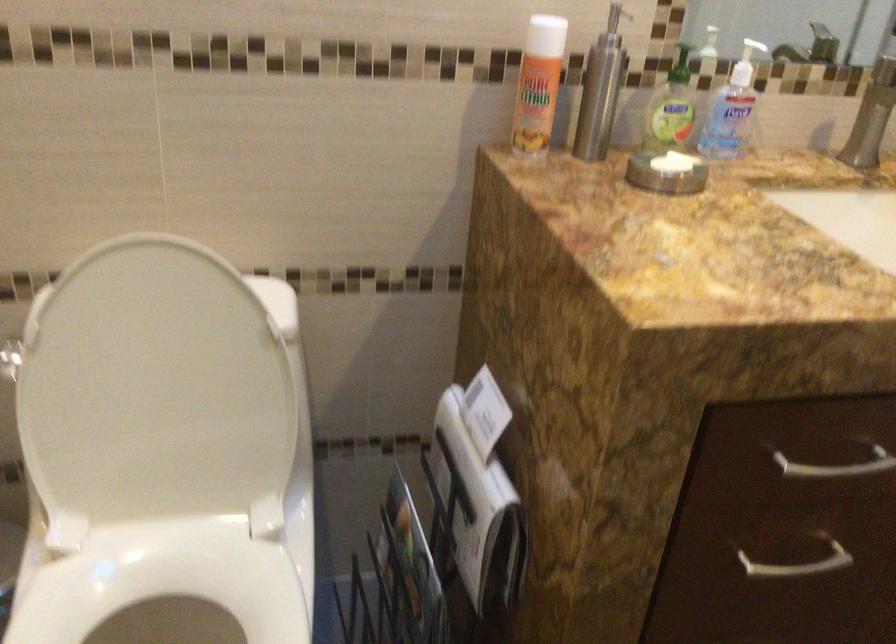
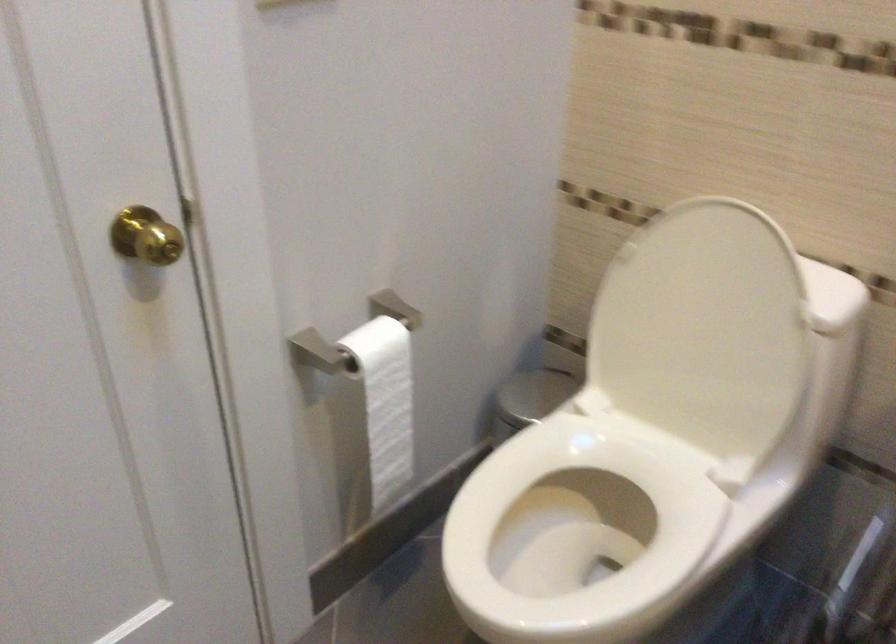
Question: The camera is either moving clockwise (left) or counter-clockwise (right) around the object. The first image is from the beginning of the video and the second image is from the end. Is the camera moving left or right when shooting the video?

Choices:
 (A) Left
 (B) Right

Answer: (B)